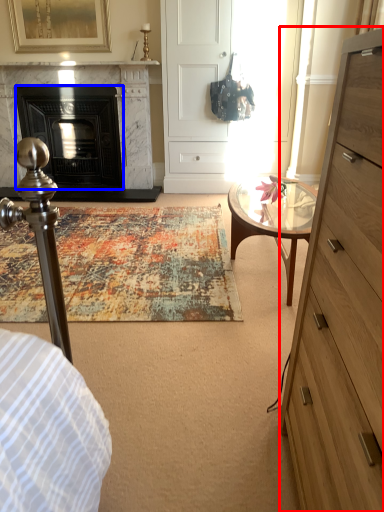
Question: Which object appears closest to the camera in this image, chest of drawers (highlighted by a red box) or fireplace (highlighted by a blue box)?

Choices:
 (A) chest of drawers
 (B) fireplace

Answer: (A)